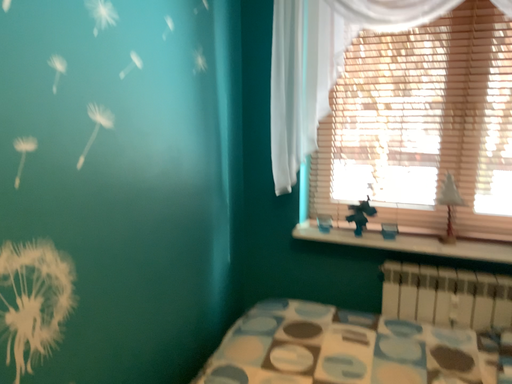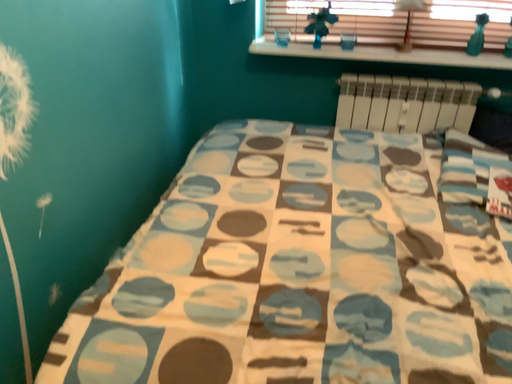
Question: How did the camera likely rotate when shooting the video?

Choices:
 (A) rotated upward
 (B) rotated downward

Answer: (B)